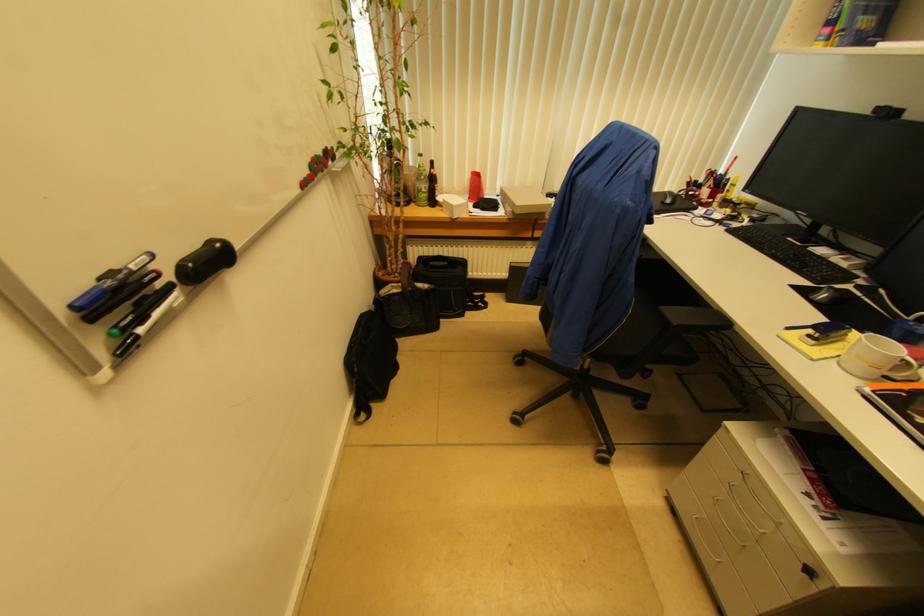
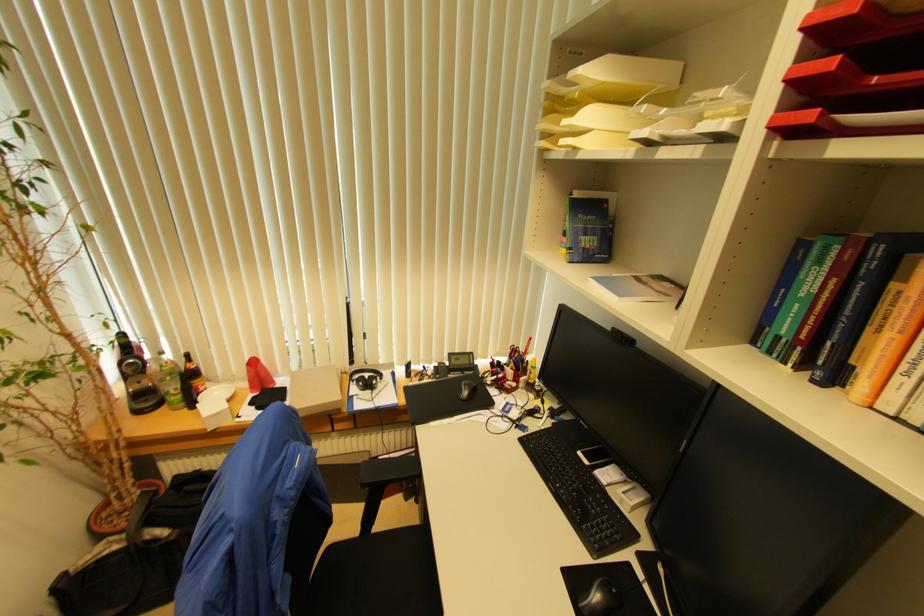
The point at (812,300) is marked in the first image. Where is the corresponding point in the second image?

(580, 608)